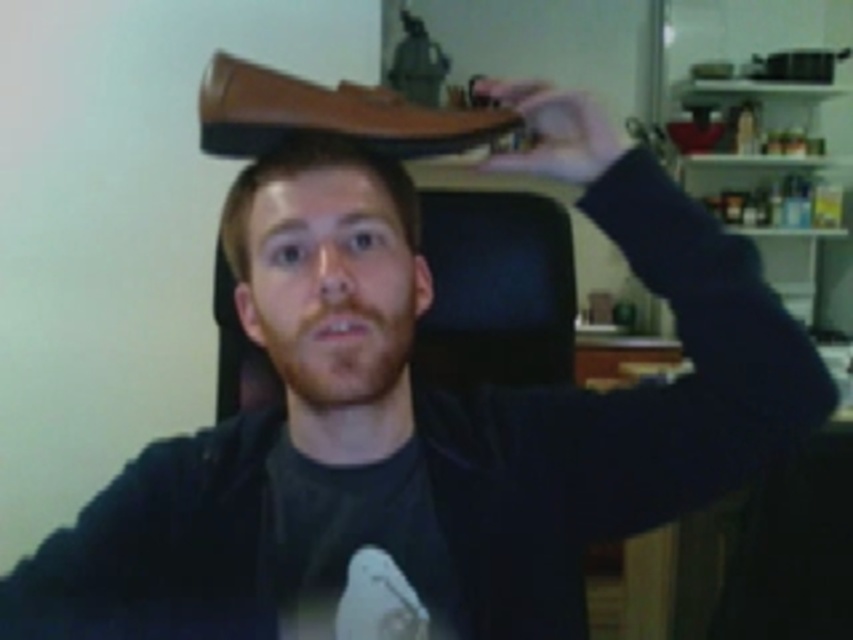
Question: Which of the following is the closest to the observer?

Choices:
 (A) brown leather shoe at upper center
 (B) brown leather hat at center

Answer: (A)

Question: Which point is closer to the camera?

Choices:
 (A) (312, 152)
 (B) (252, 134)
 (C) (573, 93)

Answer: (A)

Question: Can you confirm if brown leather shoe at upper center is positioned above brown leather hat at center?

Choices:
 (A) no
 (B) yes

Answer: (B)

Question: Does brown leather shoe at upper center come behind matte brown shoe at upper center?

Choices:
 (A) yes
 (B) no

Answer: (B)

Question: Can you confirm if brown leather shoe at upper center is wider than brown leather hat at center?

Choices:
 (A) yes
 (B) no

Answer: (A)

Question: Among these points, which one is farthest from the camera?

Choices:
 (A) click(390, 138)
 (B) click(276, 161)
 (C) click(547, 109)

Answer: (C)